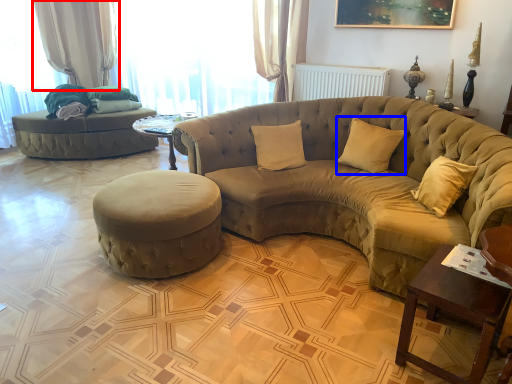
Question: Which object is closer to the camera taking this photo, curtain (highlighted by a red box) or pillow (highlighted by a blue box)?

Choices:
 (A) curtain
 (B) pillow

Answer: (B)